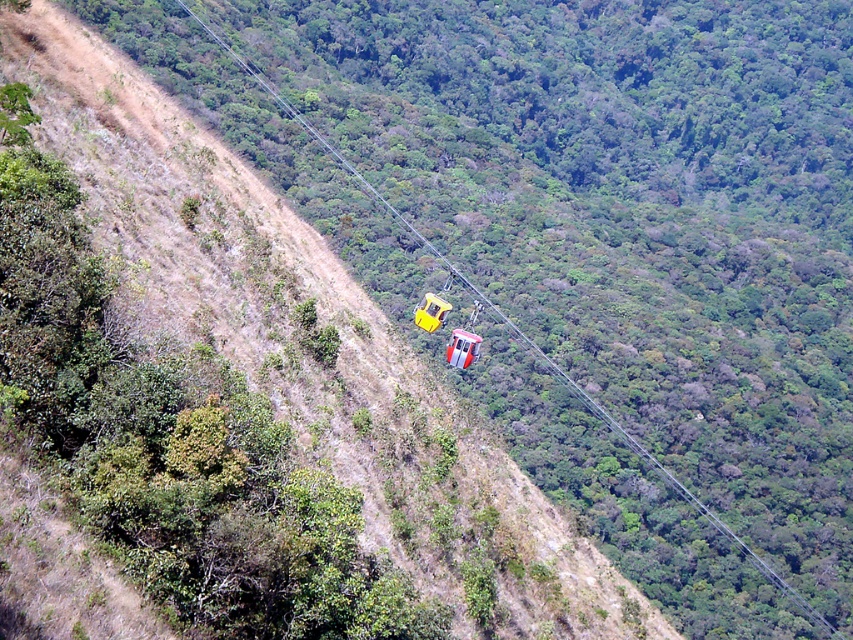
You are a hiker standing on the steep hillside in the foreground of the image. You see a yellow matte parachute at center and a yellow matte cable car at center. Which object is positioned closer to you?

The yellow matte parachute at center is closer to the viewer than the yellow matte cable car at center.

You are standing at the center of the image and see a point marked at coordinates point (462, 348). What object is this point located on?

The point (462, 348) is located on the yellow matte parachute at center.